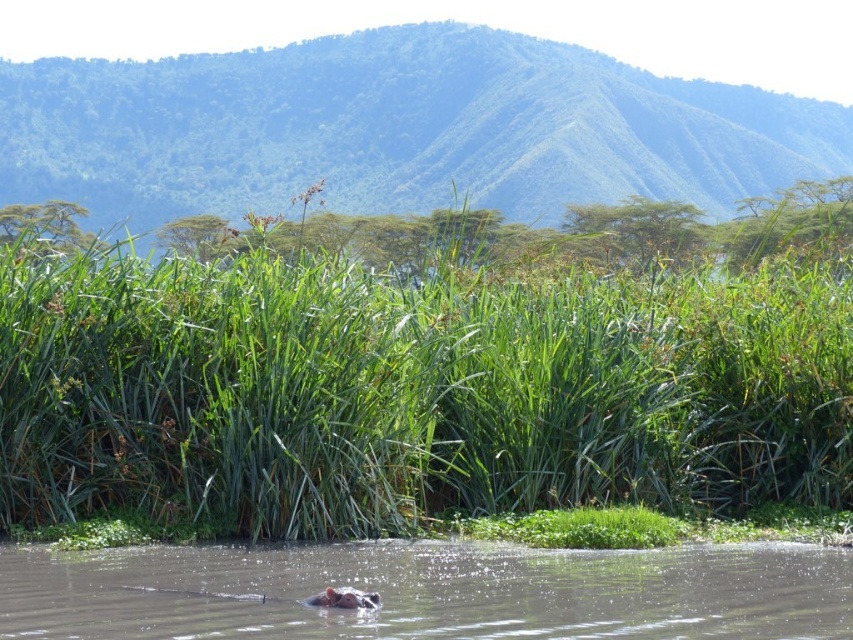
Question: Is green grassy reeds at center bigger than brown muddy water at lower center?

Choices:
 (A) yes
 (B) no

Answer: (A)

Question: Which of the following is the closest to the observer?

Choices:
 (A) green grassy reeds at center
 (B) green matte hippo at lower center
 (C) brown muddy water at lower center

Answer: (B)

Question: Which object is the farthest from the green grassy reeds at center?

Choices:
 (A) green matte hippo at lower center
 (B) brown muddy water at lower center

Answer: (B)

Question: Which object appears farthest from the camera in this image?

Choices:
 (A) green matte hippo at lower center
 (B) brown muddy water at lower center

Answer: (B)

Question: Where is green grassy reeds at center located in relation to green matte hippo at lower center in the image?

Choices:
 (A) above
 (B) below

Answer: (A)

Question: Can you confirm if green grassy reeds at center is wider than brown muddy water at lower center?

Choices:
 (A) no
 (B) yes

Answer: (B)